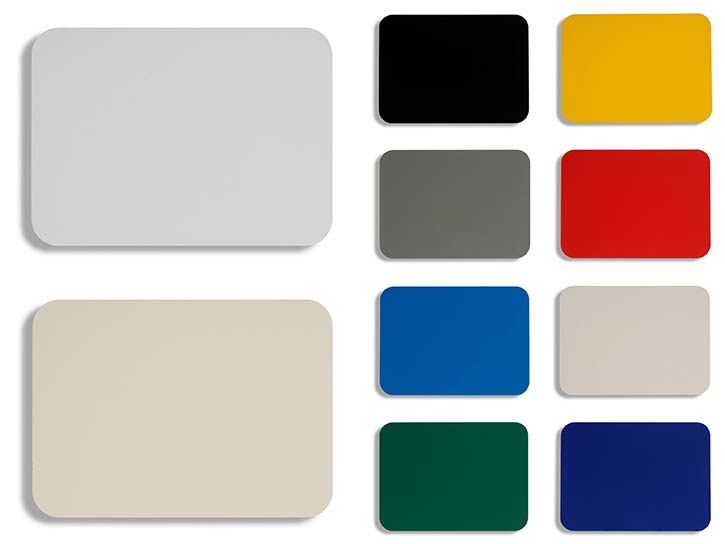
You are a GUI agent. You are given a task and a screenshot of the screen. Output one action in this format:
    pyautogui.click(x=<x>, y=<y>)
    Task: Click on the blue tile
    This screenshot has width=725, height=544.
    Given the screenshot: What is the action you would take?
    click(594, 487), click(478, 389)